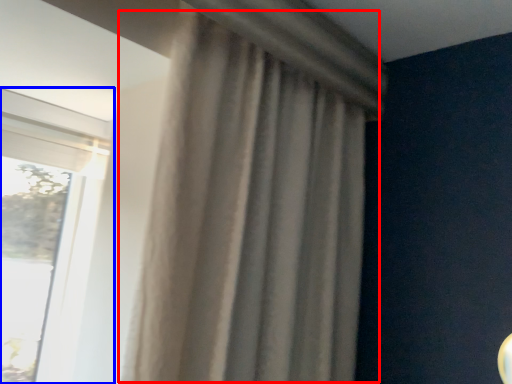
Question: Which point is further to the camera, curtain (highlighted by a red box) or window (highlighted by a blue box)?

Choices:
 (A) curtain
 (B) window

Answer: (B)